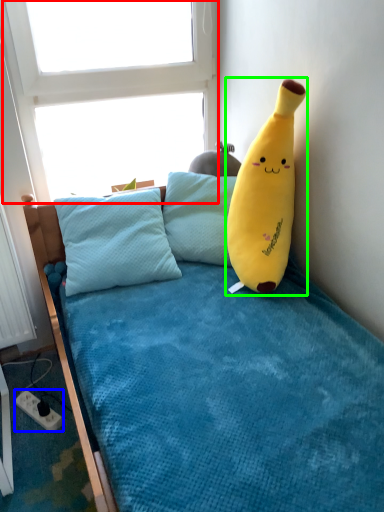
Question: Which is nearer to the window screen (highlighted by a red box)? power outlet (highlighted by a blue box) or toy (highlighted by a green box).

Choices:
 (A) power outlet
 (B) toy

Answer: (B)